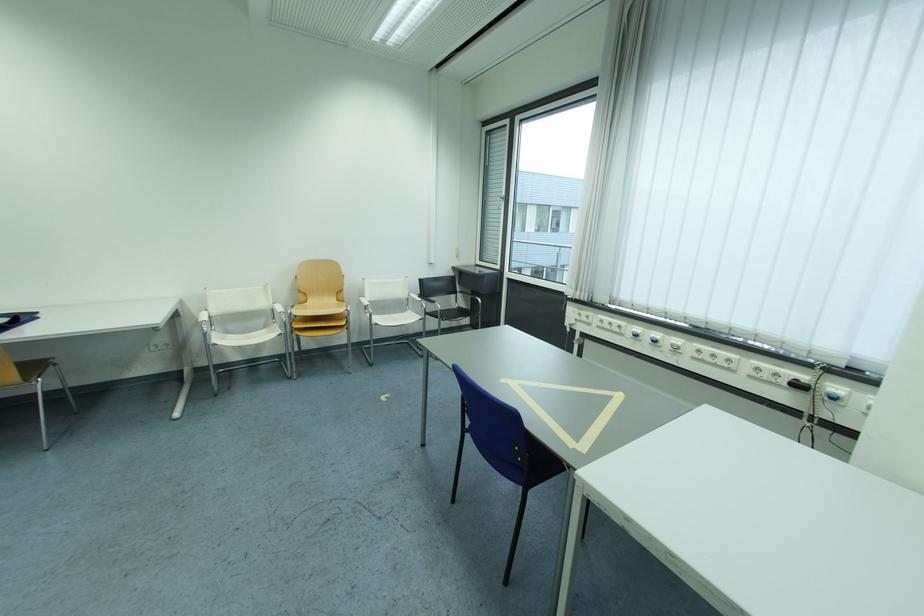
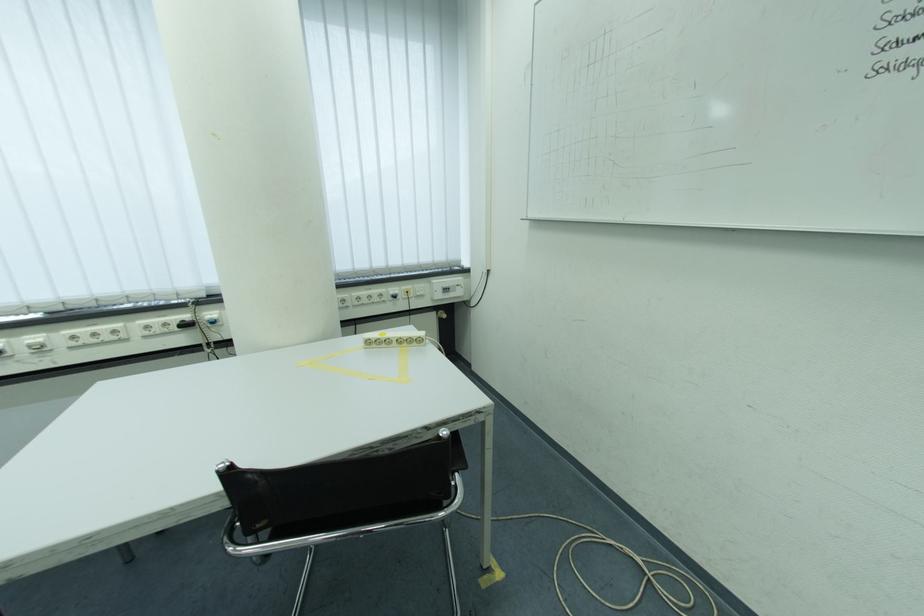
In the second image, find the point that corresponds to point (688, 346) in the first image.

(50, 342)